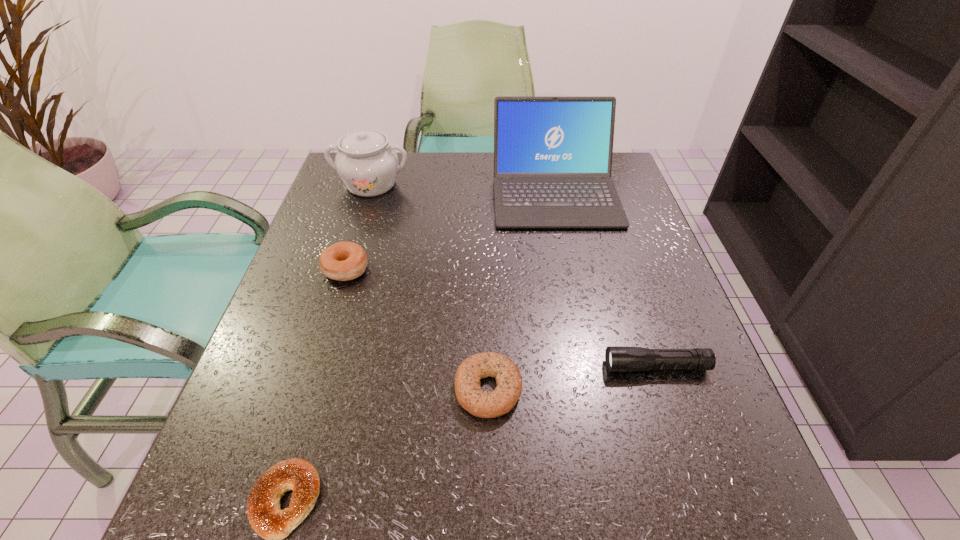
Locate an element on the screen. The height and width of the screenshot is (540, 960). the tallest object is located at coordinates (552, 155).

I want to click on chinaware, so click(368, 166).

Find the location of a particular element. This screenshot has height=540, width=960. the fourth nearest object is located at coordinates (343, 261).

Where is `the farthest bagel`? This screenshot has height=540, width=960. the farthest bagel is located at coordinates (343, 261).

You are a GUI agent. You are given a task and a screenshot of the screen. Output one action in this format:
    pyautogui.click(x=<x>, y=<y>)
    Task: Click on the flashlight
    
    Given the screenshot: What is the action you would take?
    pyautogui.click(x=617, y=358)

You are a GUI agent. You are given a task and a screenshot of the screen. Output one action in this format:
    pyautogui.click(x=<x>, y=<y>)
    Task: Click on the second tallest bagel
    
    Given the screenshot: What is the action you would take?
    pyautogui.click(x=479, y=403)

Where is `the fifth tallest object`? the fifth tallest object is located at coordinates (479, 403).

Identify the location of vacant space situated 0.180m on the screen of the laptop computer. (574, 285).

This screenshot has width=960, height=540. I want to click on free space located on the right of the fifth shortest object, so coord(470,184).

In order to click on vacant space positioned 0.100m on the front of the tallest bagel in this screenshot , I will do `click(328, 323)`.